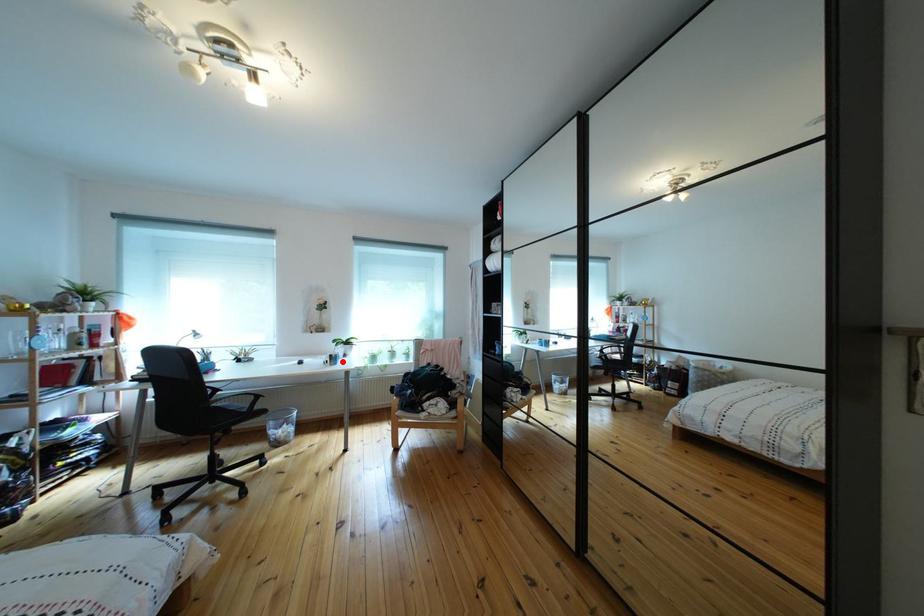
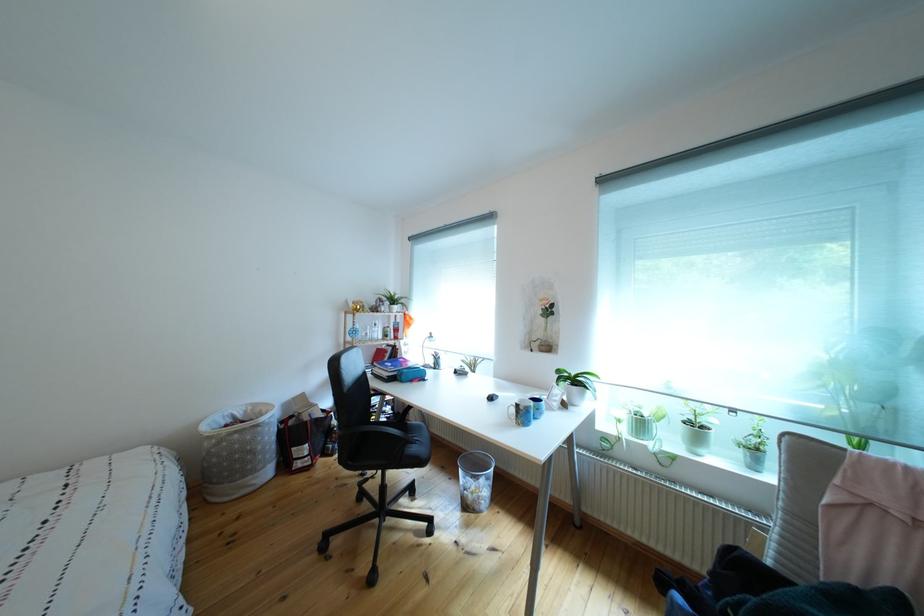
Where in the second image is the point corresponding to the highlighted location from the first image?

(529, 411)